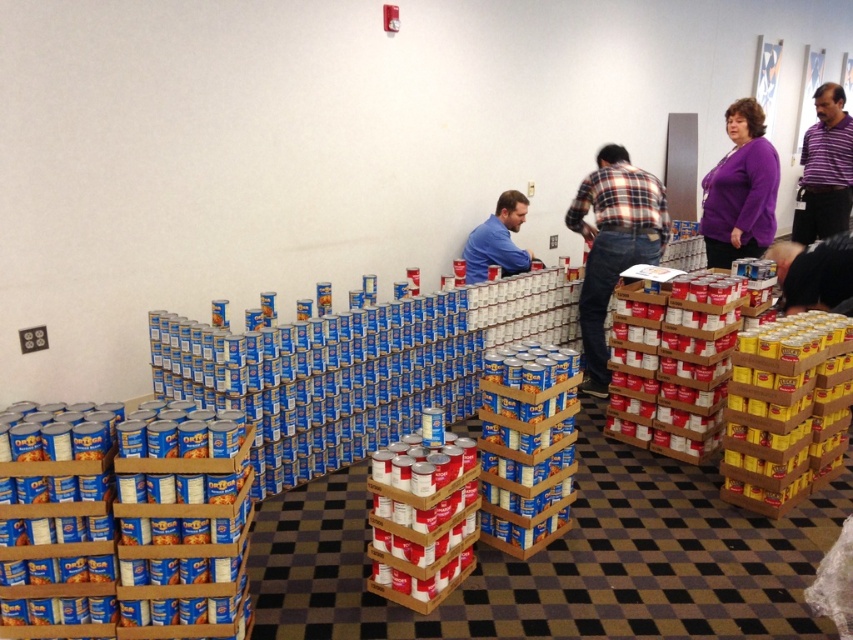
Question: Which of the following is the closest to the observer?

Choices:
 (A) (463, 248)
 (B) (844, 109)
 (C) (746, 246)
 (D) (796, 256)

Answer: (D)

Question: Which of the following is the farthest from the observer?

Choices:
 (A) [x=502, y=275]
 (B) [x=635, y=250]
 (C) [x=844, y=253]

Answer: (A)

Question: Does plaid flannel shirt at center appear on the right side of purple matte shirt at upper right?

Choices:
 (A) no
 (B) yes

Answer: (A)

Question: Which object appears farthest from the camera in this image?

Choices:
 (A) purple matte shirt at upper right
 (B) blue shirt at center
 (C) purple striped polo shirt at upper right

Answer: (C)

Question: Is purple matte shirt at upper right positioned behind blue shirt at center?

Choices:
 (A) yes
 (B) no

Answer: (B)

Question: Does purple matte shirt at upper right lie in front of blue shirt at center?

Choices:
 (A) no
 (B) yes

Answer: (B)